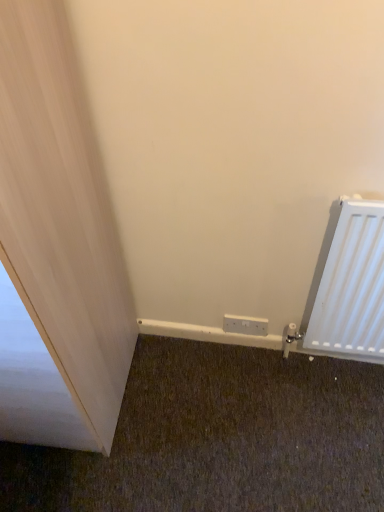
Question: Is white matte radiator at right bigger or smaller than white plastic electric outlet at lower center?

Choices:
 (A) small
 (B) big

Answer: (B)

Question: Considering the positions of point (334, 338) and point (248, 329), is point (334, 338) closer or farther from the camera than point (248, 329)?

Choices:
 (A) farther
 (B) closer

Answer: (B)

Question: From a real-world perspective, is white matte radiator at right above or below white plastic electric outlet at lower center?

Choices:
 (A) above
 (B) below

Answer: (A)

Question: Is white plastic electric outlet at lower center in front of or behind white matte radiator at right in the image?

Choices:
 (A) front
 (B) behind

Answer: (B)

Question: From a real-world perspective, relative to white matte radiator at right, is white plastic electric outlet at lower center vertically above or below?

Choices:
 (A) below
 (B) above

Answer: (A)

Question: Choose the correct answer: Is white plastic electric outlet at lower center inside white matte radiator at right or outside it?

Choices:
 (A) inside
 (B) outside

Answer: (B)

Question: Is white plastic electric outlet at lower center taller or shorter than white matte radiator at right?

Choices:
 (A) short
 (B) tall

Answer: (A)